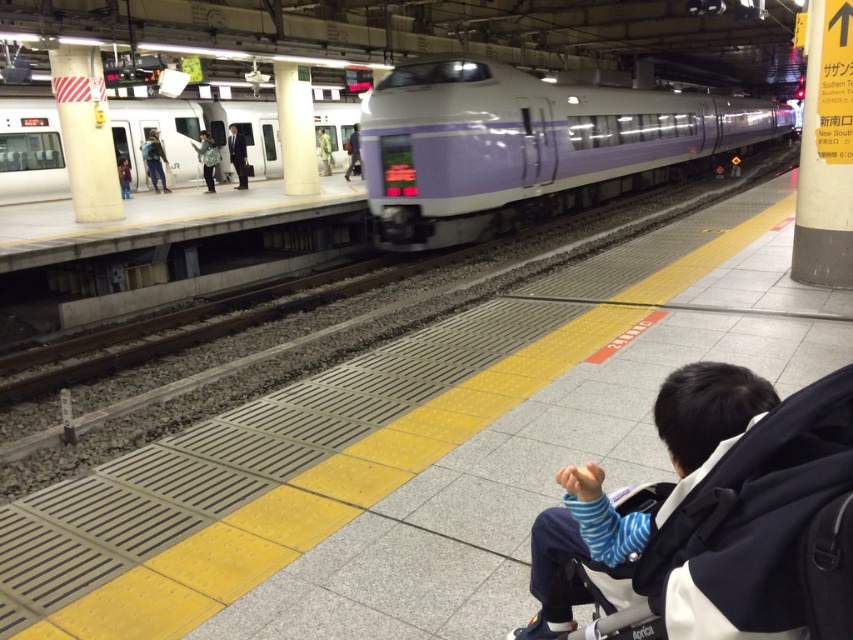
Is white glossy train at left positioned behind yellow signpost at upper right?

Yes, white glossy train at left is behind yellow signpost at upper right.

Can you confirm if white glossy train at left is smaller than yellow signpost at upper right?

Incorrect, white glossy train at left is not smaller in size than yellow signpost at upper right.

Is point (119, 113) less distant than point (830, 253)?

No, it is not.

Image resolution: width=853 pixels, height=640 pixels. Identify the location of white glossy train at left. pyautogui.click(x=194, y=134).

This screenshot has width=853, height=640. What are the coordinates of `purple glossy train at center` in the screenshot? It's located at (529, 147).

Measure the distance between purple glossy train at center and blue jeans at left.

purple glossy train at center is 37.11 feet from blue jeans at left.

You are a GUI agent. You are given a task and a screenshot of the screen. Output one action in this format:
    pyautogui.click(x=<x>, y=<y>)
    Task: Click on the purple glossy train at center
    This screenshot has height=640, width=853.
    Given the screenshot: What is the action you would take?
    pyautogui.click(x=529, y=147)

Is white glossy train at left to the right of camouflage fabric jacket at center from the viewer's perspective?

In fact, white glossy train at left is to the left of camouflage fabric jacket at center.

Identify the location of white glossy train at left. Image resolution: width=853 pixels, height=640 pixels. (194, 134).